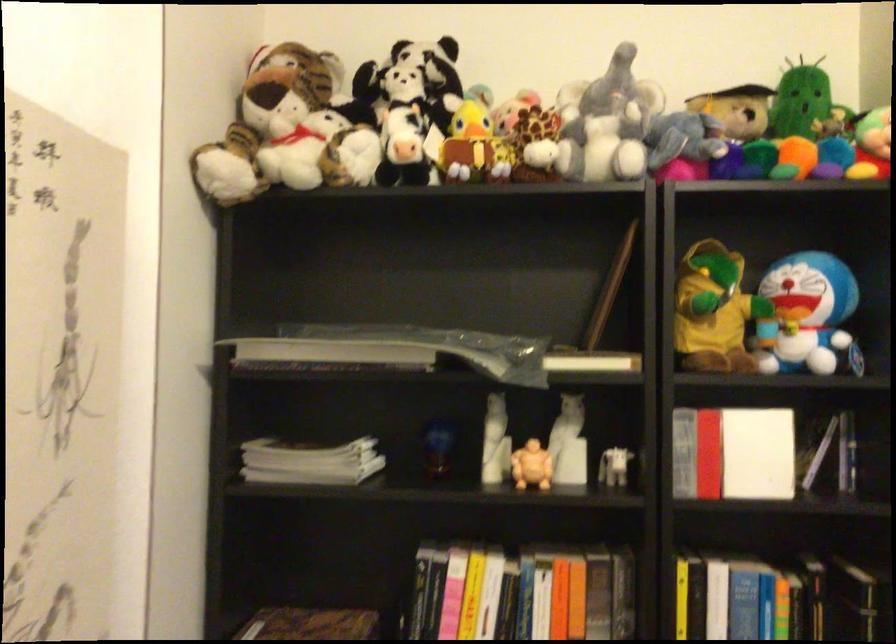
At what (x,y) coordinates should I click in order to perform the action: click on stuffed cow toy. Please return your answer as a coordinate pair (x, y). Image resolution: width=896 pixels, height=644 pixels. Looking at the image, I should click on (x=615, y=468).